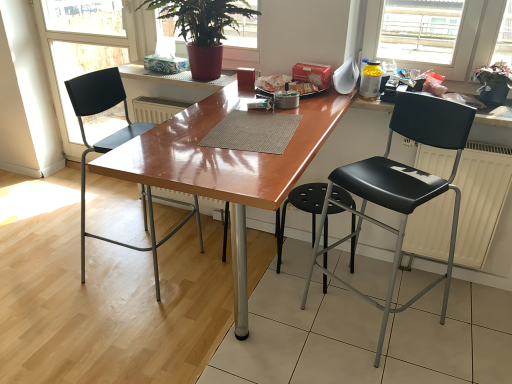
At what (x,y) coordinates should I click in order to perform the action: click on vacant space positioned to the left of glossy wood desk at center. Please return your answer as a coordinate pair (x, y). Looking at the image, I should click on point(92,299).